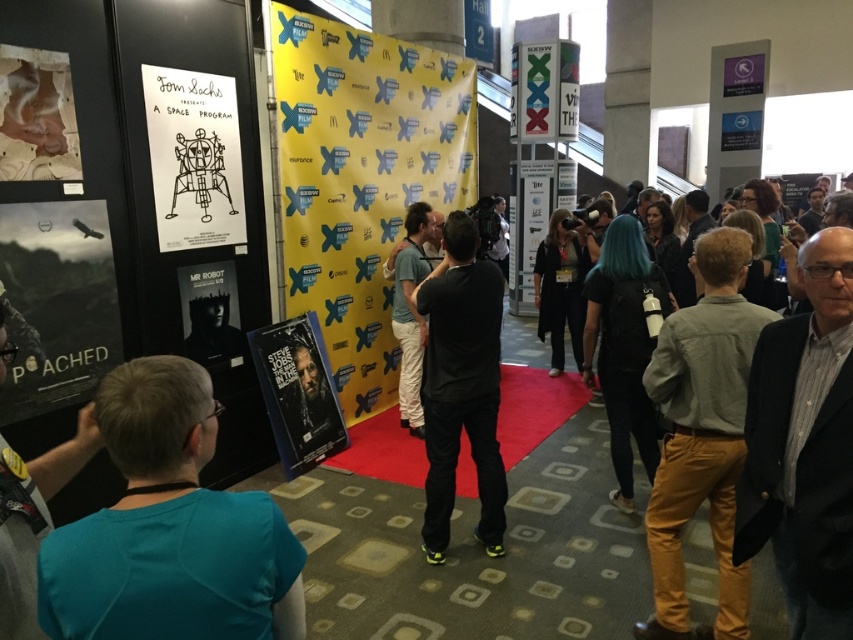
Question: Which object is positioned farthest from the yellow fabric poster at center?

Choices:
 (A) matte paper poster at left
 (B) black leather jacket at center
 (C) wooden textured poster at upper left

Answer: (C)

Question: Can you confirm if teal shirt at left is positioned below light brown cotton pants at center?

Choices:
 (A) yes
 (B) no

Answer: (B)

Question: Can you confirm if black matte shirt at center is bigger than blue shirt at lower left?

Choices:
 (A) yes
 (B) no

Answer: (A)

Question: Which of the following is the closest to the observer?

Choices:
 (A) (21, 138)
 (B) (225, 163)

Answer: (A)

Question: Does wooden textured poster at upper left have a smaller size compared to light blue jeans at center?

Choices:
 (A) yes
 (B) no

Answer: (A)

Question: Which object is farther from the camera taking this photo?

Choices:
 (A) white paper poster at left
 (B) black leather jacket at center

Answer: (B)